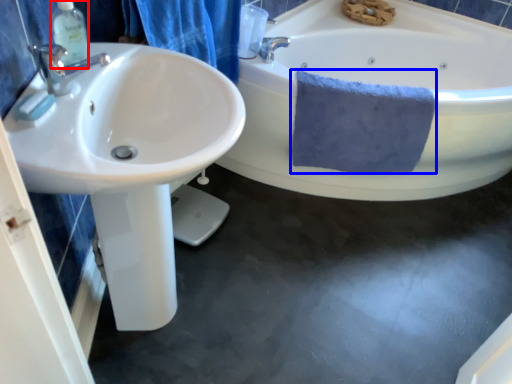
Question: Which of the following is the farthest to the observer, soap dispenser (highlighted by a red box) or bath towel (highlighted by a blue box)?

Choices:
 (A) soap dispenser
 (B) bath towel

Answer: (B)